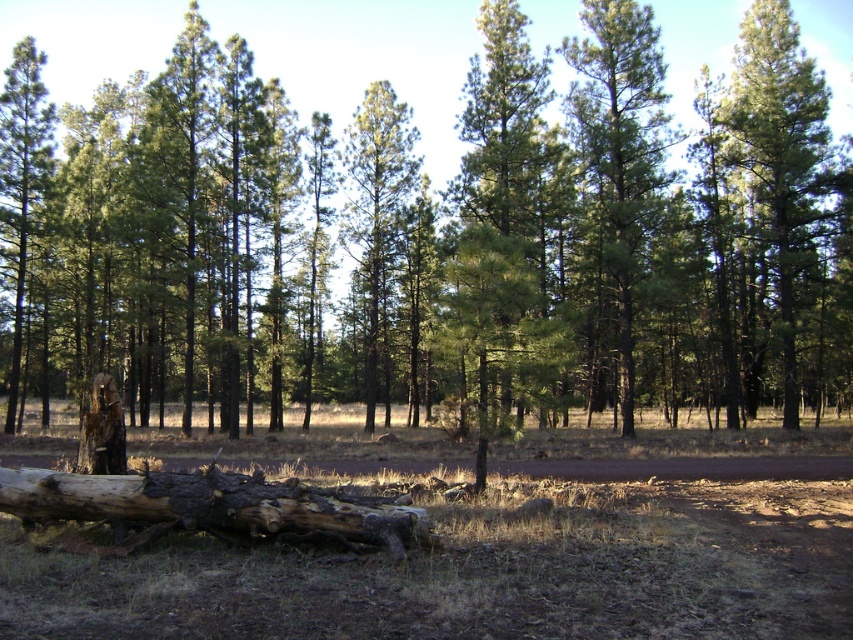
You are standing in the forest and want to walk from point A to point B. Point A is at coordinate point (607, 276) and point B is at coordinate point (781, 131). Which direction should you move to get closer to point B?

To move from point A at (607, 276) to point B at (781, 131), you should move upwards because point A is closer to the viewer than point B, which is further away. Since the coordinates are in a normalized image plane, moving towards the top of the image would take you closer to point B.

You are a hiker who wants to rest under the shade of a large tree. Given the green matte tree at center and the charred wood stump at lower left, which one would provide more shade?

The green matte tree at center would provide more shade because it has a larger size compared to the charred wood stump at lower left.